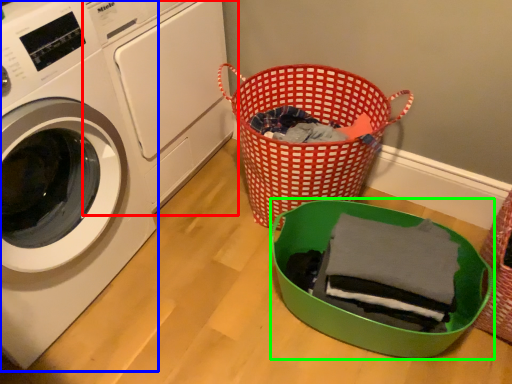
Question: Which is nearer to the washing machine (highlighted by a red box)? washing machine (highlighted by a blue box) or basket (highlighted by a green box).

Choices:
 (A) washing machine
 (B) basket

Answer: (A)